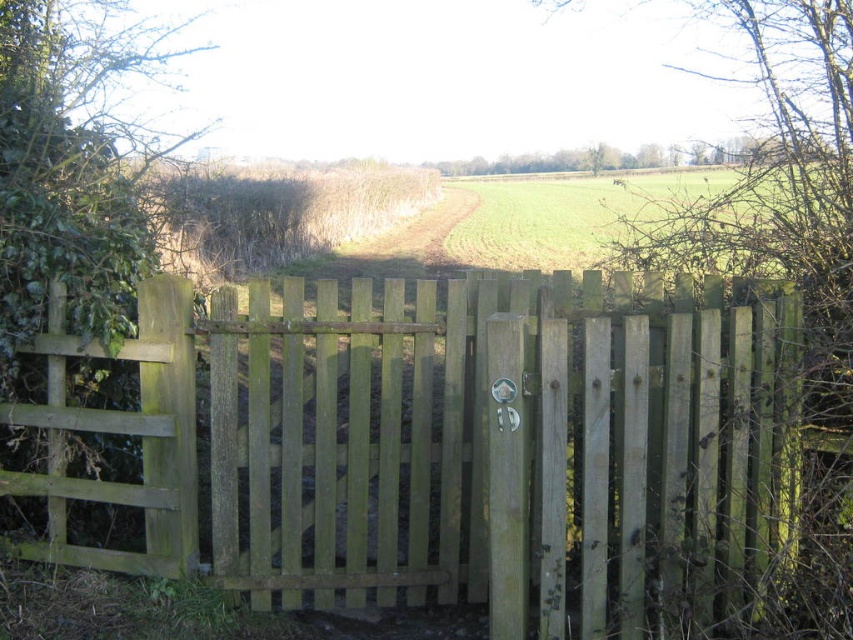
Question: Is green wooden gate at center closer to camera compared to brown dry hedge at center?

Choices:
 (A) no
 (B) yes

Answer: (B)

Question: Which object is positioned farthest from the brown dry hedge at center?

Choices:
 (A) green wooden gate at center
 (B) green grass field at center

Answer: (A)

Question: Which is farther from the green grass field at center?

Choices:
 (A) green wooden gate at center
 (B) brown dry hedge at center

Answer: (A)

Question: Does brown dry hedge at center appear on the left side of green grass field at center?

Choices:
 (A) no
 (B) yes

Answer: (B)

Question: Is the position of green wooden gate at center more distant than that of brown dry hedge at center?

Choices:
 (A) no
 (B) yes

Answer: (A)

Question: Which object is positioned farthest from the brown dry hedge at center?

Choices:
 (A) green grass field at center
 (B) green wooden gate at center

Answer: (B)